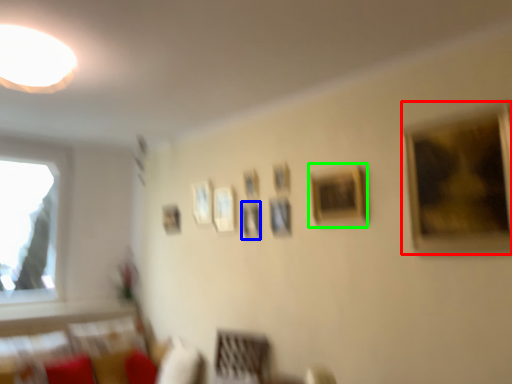
Question: Considering the real-world distances, which object is closest to picture frame (highlighted by a red box)? picture frame (highlighted by a blue box) or picture frame (highlighted by a green box).

Choices:
 (A) picture frame
 (B) picture frame

Answer: (B)